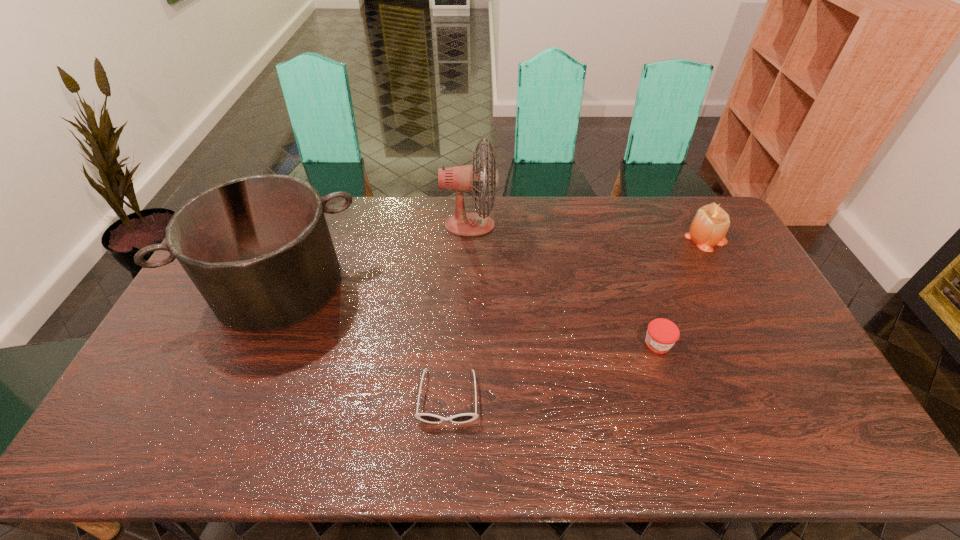
I want to click on free region at the far edge, so click(416, 199).

In the image, there is a desktop. Where is `vacant space at the near edge`? The width and height of the screenshot is (960, 540). vacant space at the near edge is located at coordinates (701, 426).

Locate an element on the screen. This screenshot has height=540, width=960. vacant space at the left edge is located at coordinates (189, 348).

The image size is (960, 540). I want to click on vacant space at the right edge of the desktop, so click(789, 355).

The height and width of the screenshot is (540, 960). Identify the location of vacant area at the far right corner of the desktop. (688, 220).

I want to click on empty space that is in between the second object from right to left and the fan, so click(x=564, y=285).

The image size is (960, 540). I want to click on vacant area between the fourth object from left to right and the fan, so click(564, 285).

Where is `free spot between the fourth object from left to right and the fan`? The height and width of the screenshot is (540, 960). free spot between the fourth object from left to right and the fan is located at coordinates (564, 285).

The image size is (960, 540). In order to click on vacant space that is in between the fan and the candle in this screenshot , I will do `click(588, 231)`.

You are a GUI agent. You are given a task and a screenshot of the screen. Output one action in this format:
    pyautogui.click(x=<x>, y=<y>)
    Task: Click on the free space between the fan and the sunglasses
    The width and height of the screenshot is (960, 540).
    Given the screenshot: What is the action you would take?
    pyautogui.click(x=459, y=311)